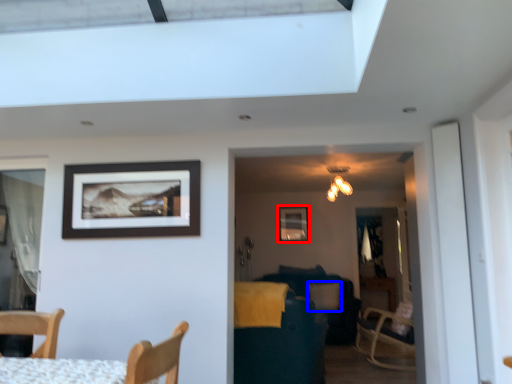
Question: Which of the following is the farthest to the observer, picture frame (highlighted by a red box) or pillow (highlighted by a blue box)?

Choices:
 (A) picture frame
 (B) pillow

Answer: (A)